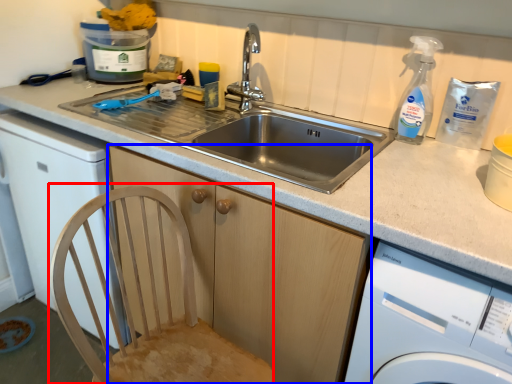
Question: Among these objects, which one is nearest to the camera, feeding chair (highlighted by a red box) or cabinetry (highlighted by a blue box)?

Choices:
 (A) feeding chair
 (B) cabinetry

Answer: (A)